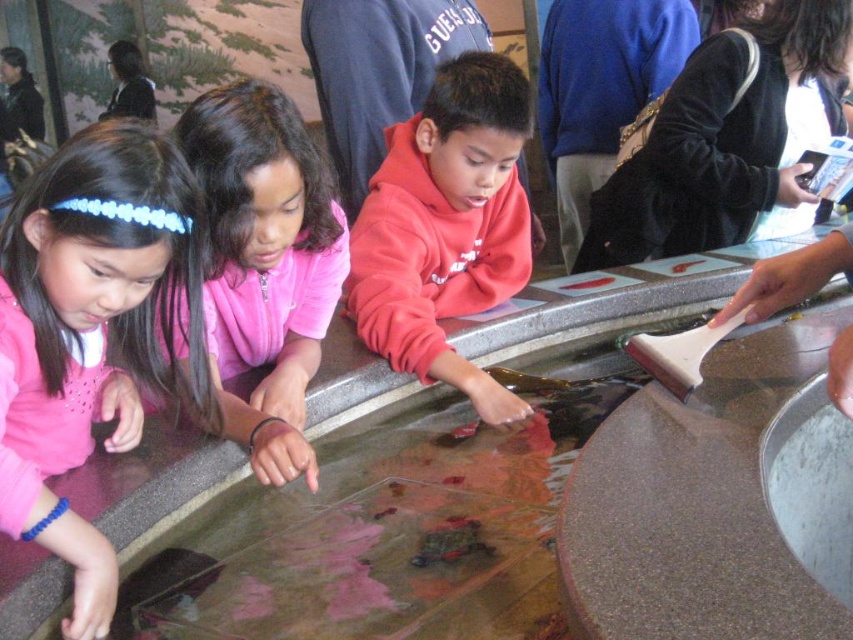
Does pink fleece jacket at left appear on the left side of red fleece sweatshirt at center?

Correct, you'll find pink fleece jacket at left to the left of red fleece sweatshirt at center.

How much distance is there between pink fleece jacket at left and red fleece sweatshirt at center?

The distance of pink fleece jacket at left from red fleece sweatshirt at center is 29.02 inches.

Is point (125, 346) positioned behind point (448, 228)?

No.

Find the location of a particular element. pink fleece jacket at left is located at coordinates (91, 328).

Does red fleece sweatshirt at center have a greater width compared to pink fleece jacket at center?

Yes.

Is point (515, 182) farther from viewer compared to point (247, 269)?

That is True.

Where is `red fleece sweatshirt at center`? This screenshot has width=853, height=640. red fleece sweatshirt at center is located at coordinates (445, 227).

Which of these two, pink fleece jacket at left or pink fleece jacket at center, stands taller?

pink fleece jacket at left

Between pink fleece jacket at left and pink fleece jacket at center, which one is positioned higher?

pink fleece jacket at center is higher up.

Locate an element on the screen. The image size is (853, 640). pink fleece jacket at left is located at coordinates (91, 328).